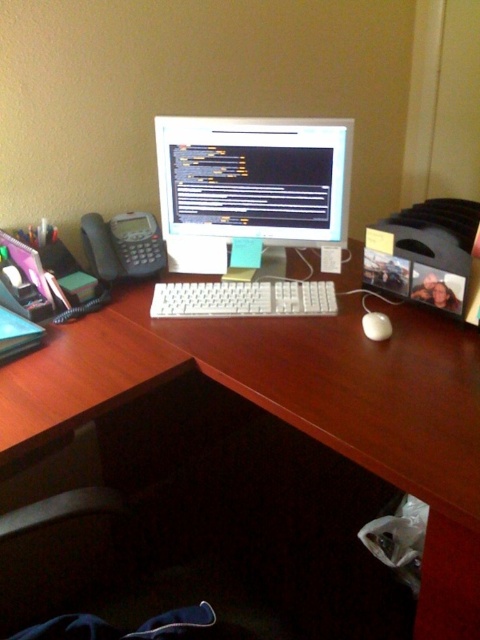
You are organizing a desk and need to place a 15 cm tall paperweight. The white wood computer desk at center has limited space. Can the paperweight fit on the desk without blocking the white matte mouse at center?

The white wood computer desk at center is taller than the white matte mouse at center, but the height difference does not affect the placement of the paperweight. Since the desk has limited space, you should ensure there is enough room next to or behind the mouse to place the paperweight without blocking it.